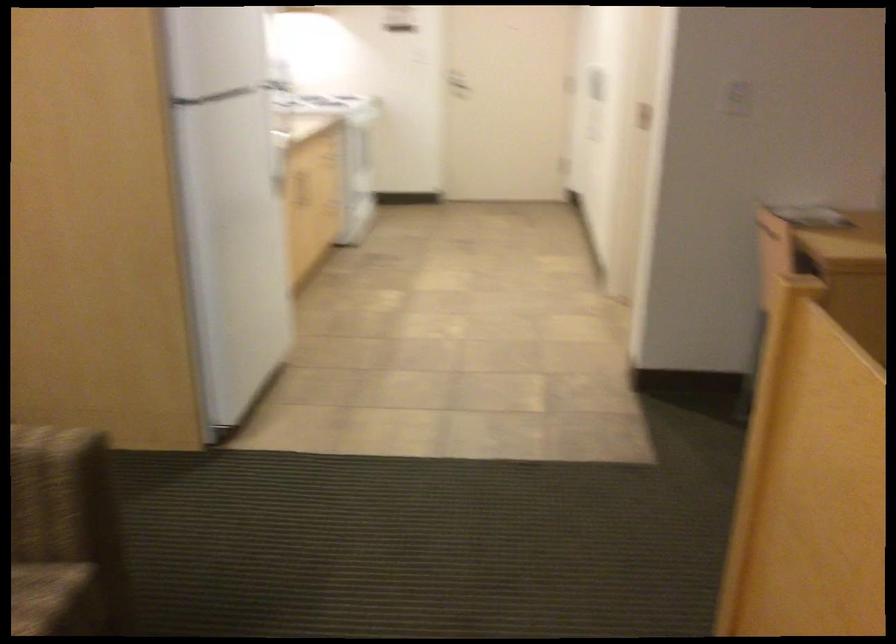
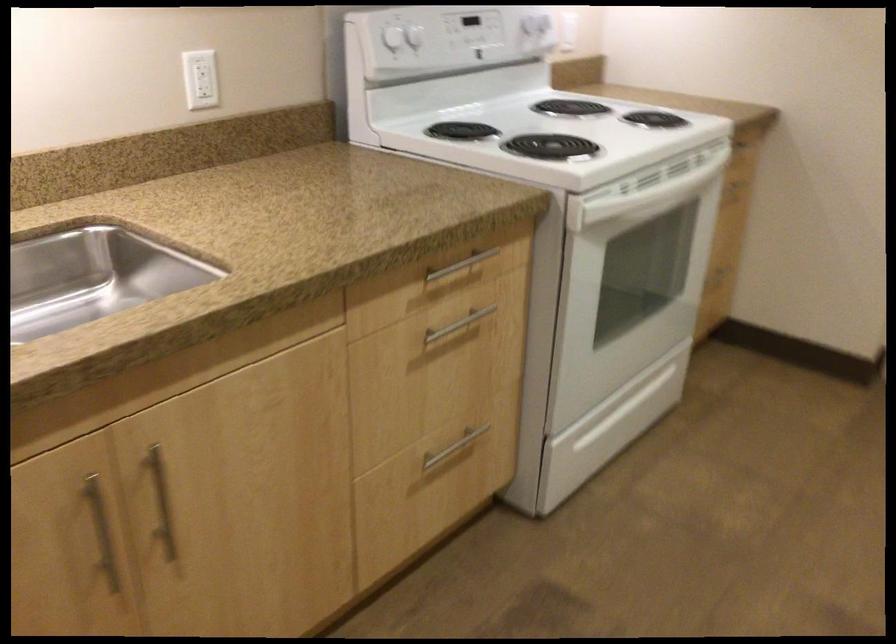
Where in the second image is the point corresponding to (x=314, y=185) from the first image?

(101, 532)